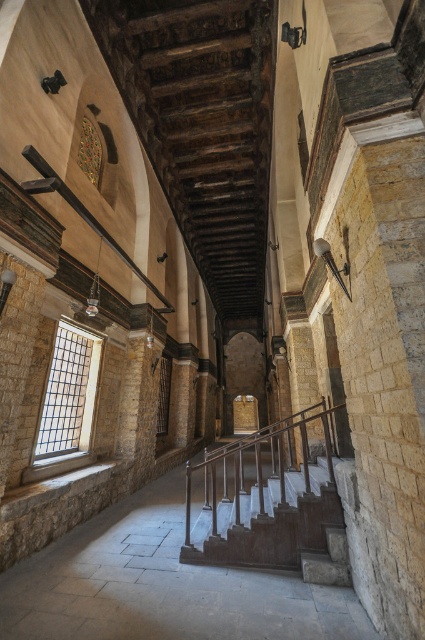
Does dark brown stone stairs at center have a lesser width compared to clear glass window at left?

Incorrect, dark brown stone stairs at center's width is not less than clear glass window at left's.

Based on the photo, measure the distance from dark brown stone stairs at center to clear glass window at left.

The distance of dark brown stone stairs at center from clear glass window at left is 9.03 feet.

Does point (257, 513) lie behind point (53, 401)?

No, it is not.

Identify the location of dark brown stone stairs at center. (278, 529).

Is polished wood railing at center further to camera compared to clear glass window at left?

That is False.

Is polished wood railing at center thinner than clear glass window at left?

No.

Describe the element at coordinates (268, 497) in the screenshot. I see `polished wood railing at center` at that location.

The height and width of the screenshot is (640, 425). Identify the location of polished wood railing at center. (268, 497).

Between polished wood railing at center and dark brown stone stairs at center, which one has less height?

dark brown stone stairs at center

Can you confirm if polished wood railing at center is bigger than dark brown stone stairs at center?

Correct, polished wood railing at center is larger in size than dark brown stone stairs at center.

The width and height of the screenshot is (425, 640). In order to click on polished wood railing at center in this screenshot , I will do point(268,497).